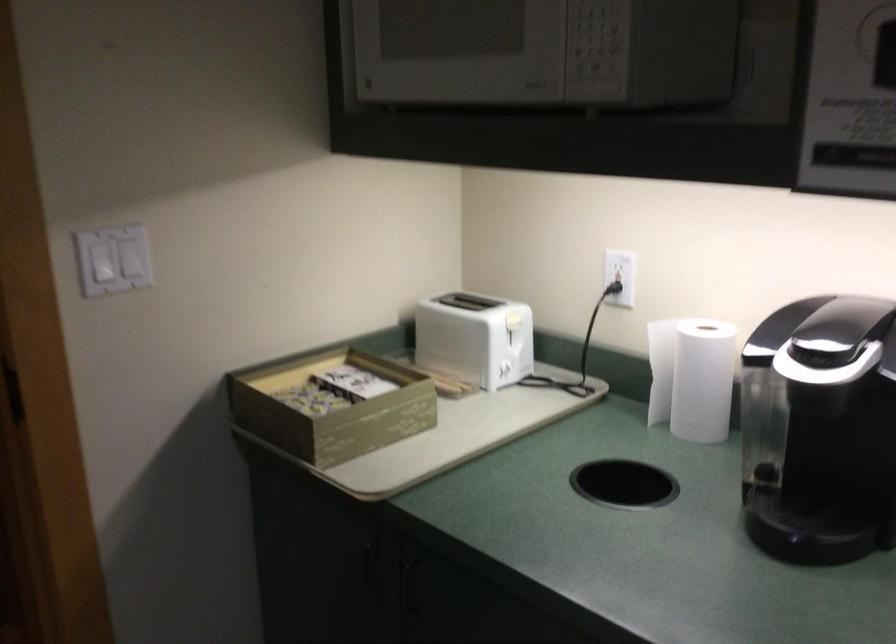
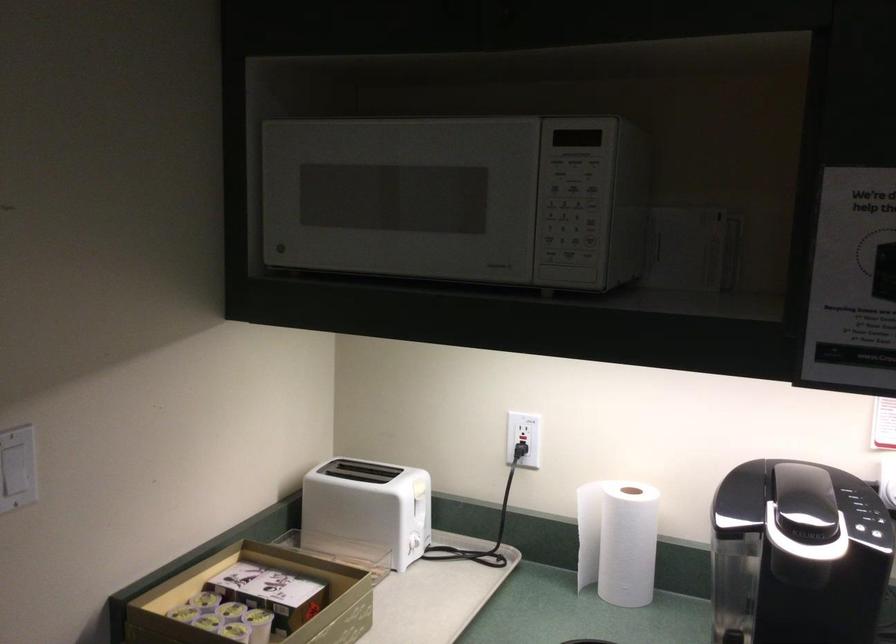
In the second image, find the point that corresponds to (495,365) in the first image.

(408, 542)